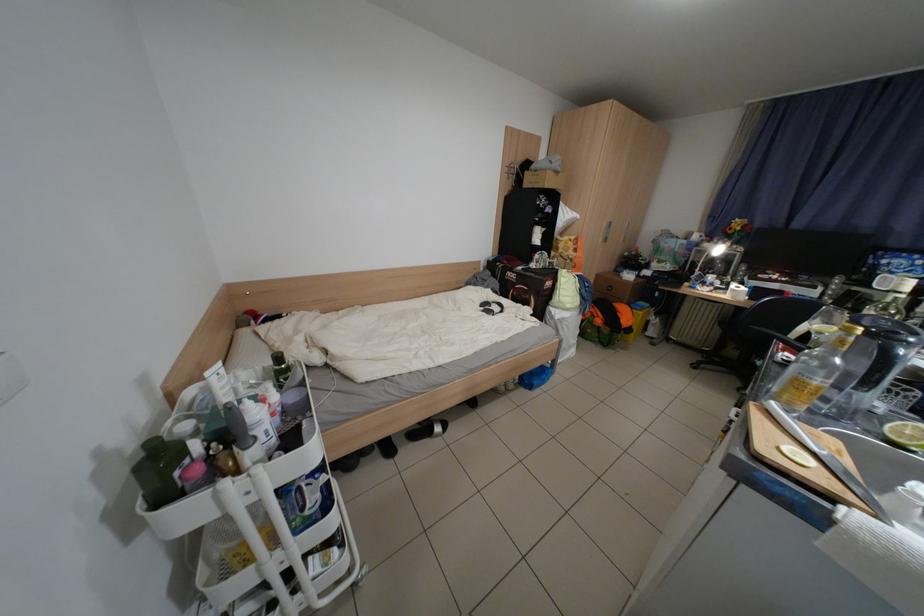
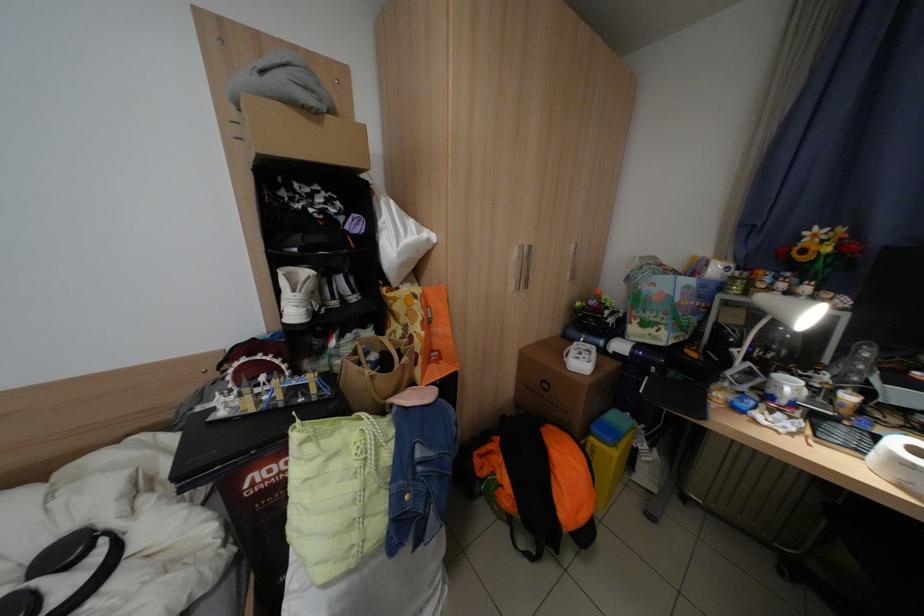
The point at (x=630, y=321) is marked in the first image. Where is the corresponding point in the second image?

(565, 508)